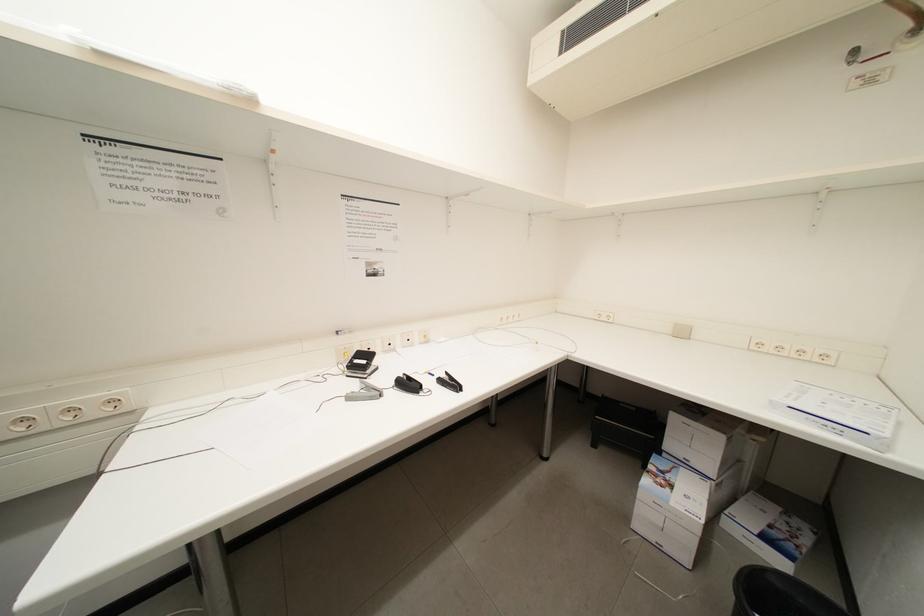
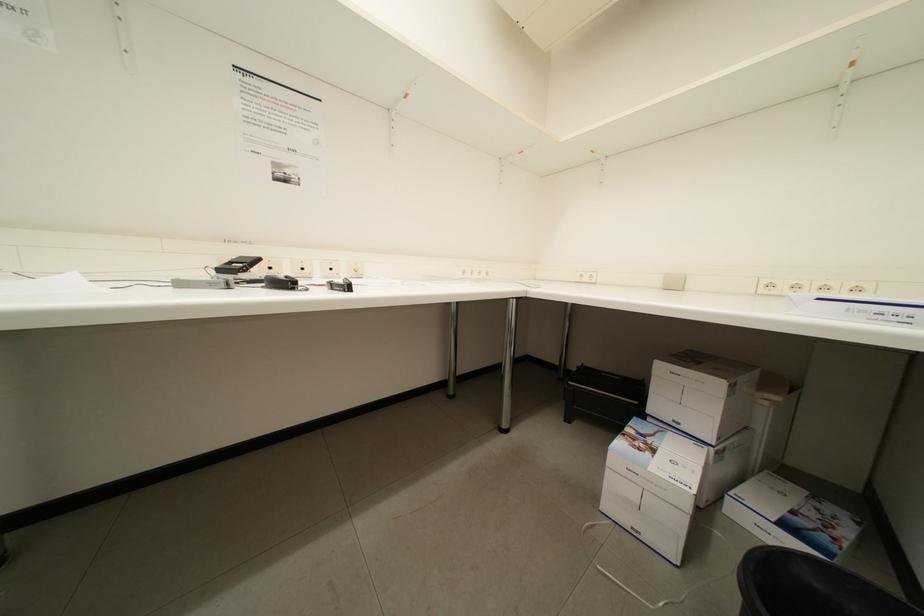
Question: The first image is from the beginning of the video and the second image is from the end. How did the camera likely rotate when shooting the video?

Choices:
 (A) Left
 (B) Right
 (C) Up
 (D) Down

Answer: (C)